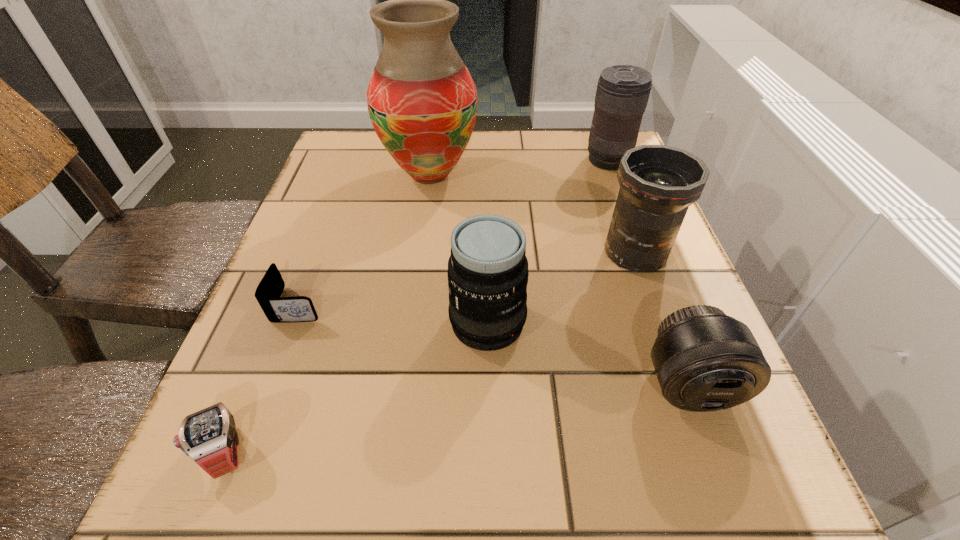
Find the location of a particular element. Image resolution: width=960 pixels, height=540 pixels. watch that is positioned at the left edge is located at coordinates (209, 437).

Find the location of a particular element. The height and width of the screenshot is (540, 960). wallet at the left edge is located at coordinates (277, 309).

You are a GUI agent. You are given a task and a screenshot of the screen. Output one action in this format:
    pyautogui.click(x=<x>, y=<y>)
    Task: Click on the object that is at the far left corner
    This screenshot has height=540, width=960.
    Given the screenshot: What is the action you would take?
    pyautogui.click(x=422, y=101)

I want to click on object located at the near left corner, so click(x=209, y=437).

Find the location of a particular element. The height and width of the screenshot is (540, 960). object that is at the far right corner is located at coordinates (622, 94).

At what (x,y) coordinates should I click in order to perform the action: click on vacant area at the far edge of the desktop. Please return your answer as a coordinate pair (x, y). The height and width of the screenshot is (540, 960). Looking at the image, I should click on (516, 141).

What are the coordinates of `vacant space at the near edge` in the screenshot? It's located at (498, 464).

The width and height of the screenshot is (960, 540). In the image, there is a desktop. Identify the location of free space at the left edge. (339, 282).

The image size is (960, 540). In order to click on vacant area at the far left corner of the desktop in this screenshot , I will do `click(340, 132)`.

Find the location of `free space at the near left corner of the desktop`. free space at the near left corner of the desktop is located at coordinates (211, 501).